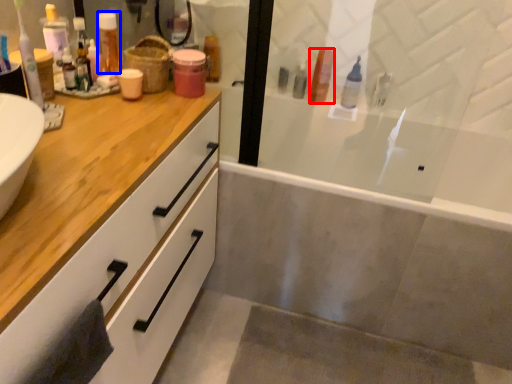
Question: Which object appears closest to the camera in this image, toiletry (highlighted by a red box) or toiletry (highlighted by a blue box)?

Choices:
 (A) toiletry
 (B) toiletry

Answer: (B)